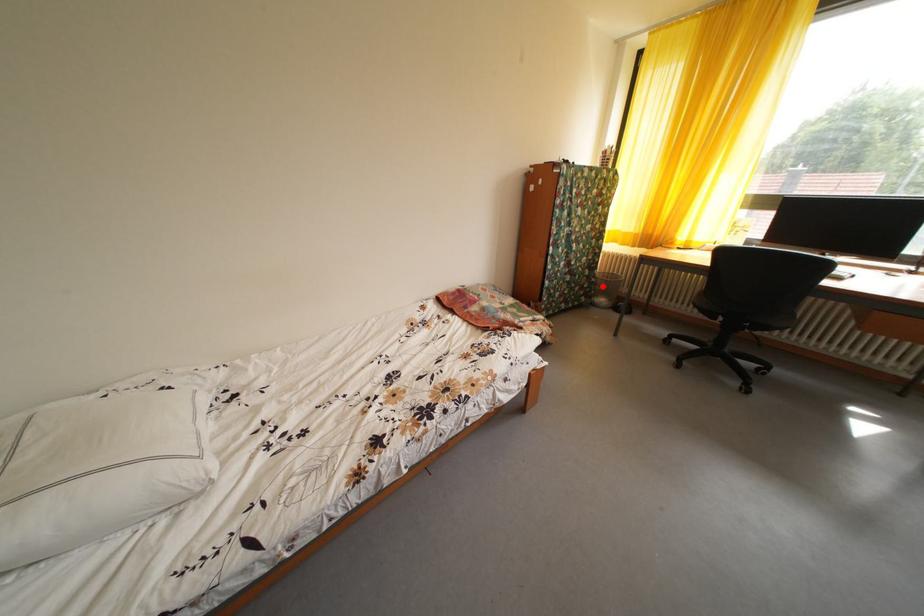
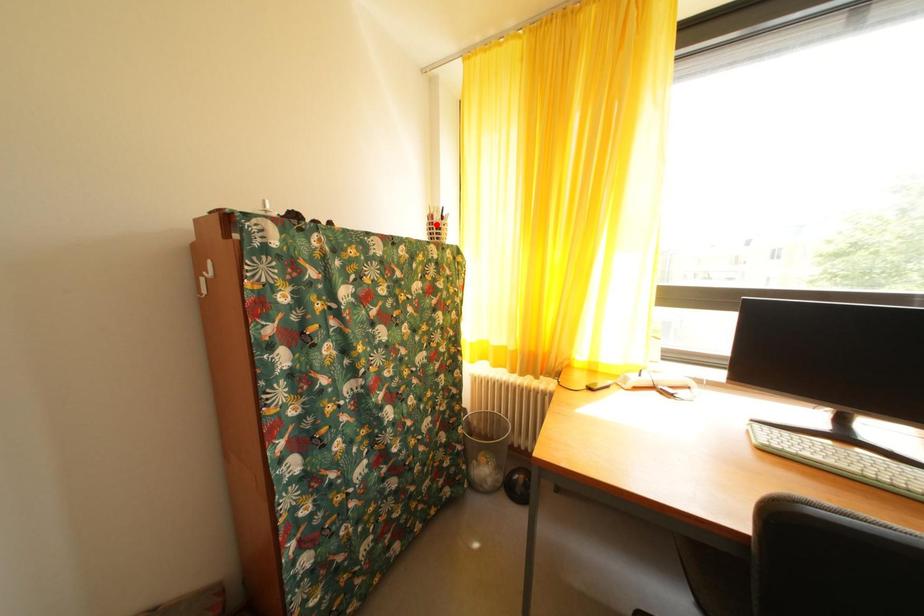
I am providing you with two images of the same scene from different viewpoints. A red point is marked on the first image and another point is marked on the second image. Does the point marked in image1 correspond to the same location as the one in image2?

No